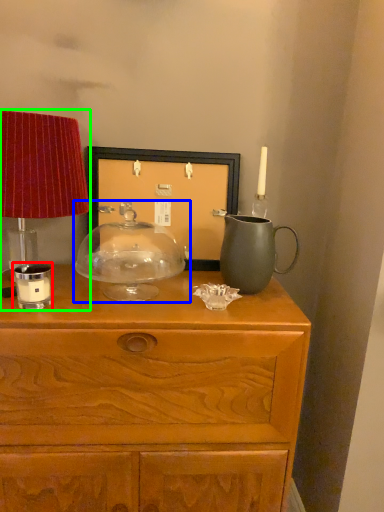
Question: Which is farther away from candle holder (highlighted by a red box)? candle holder (highlighted by a blue box) or table lamp (highlighted by a green box)?

Choices:
 (A) candle holder
 (B) table lamp

Answer: (A)